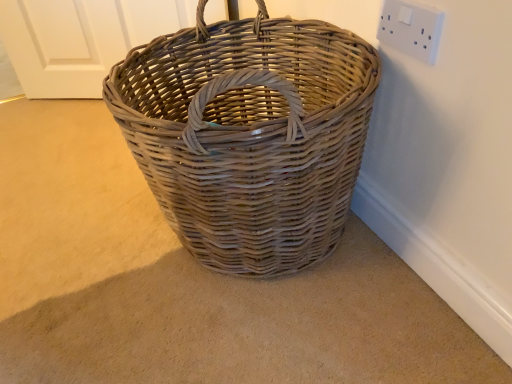
Question: Is white plastic socket at upper right not near natural wicker picnic basket at center?

Choices:
 (A) yes
 (B) no

Answer: (B)

Question: Can you confirm if white plastic socket at upper right is shorter than natural wicker picnic basket at center?

Choices:
 (A) no
 (B) yes

Answer: (B)

Question: Is the depth of white plastic socket at upper right greater than that of natural wicker picnic basket at center?

Choices:
 (A) yes
 (B) no

Answer: (A)

Question: Does white plastic socket at upper right touch natural wicker picnic basket at center?

Choices:
 (A) yes
 (B) no

Answer: (B)

Question: Is white plastic socket at upper right at the right side of natural wicker picnic basket at center?

Choices:
 (A) yes
 (B) no

Answer: (A)

Question: Is white plastic socket at upper right taller than natural wicker picnic basket at center?

Choices:
 (A) no
 (B) yes

Answer: (A)

Question: Could you tell me if natural wicker picnic basket at center is facing white plastic socket at upper right?

Choices:
 (A) yes
 (B) no

Answer: (B)

Question: Does natural wicker picnic basket at center come behind white plastic socket at upper right?

Choices:
 (A) no
 (B) yes

Answer: (A)

Question: From the image's perspective, is natural wicker picnic basket at center located above white plastic socket at upper right?

Choices:
 (A) no
 (B) yes

Answer: (A)

Question: Does natural wicker picnic basket at center have a smaller size compared to white plastic socket at upper right?

Choices:
 (A) no
 (B) yes

Answer: (A)

Question: Is natural wicker picnic basket at center surrounding white plastic socket at upper right?

Choices:
 (A) yes
 (B) no

Answer: (B)

Question: From a real-world perspective, is natural wicker picnic basket at center on white plastic socket at upper right?

Choices:
 (A) yes
 (B) no

Answer: (B)

Question: Does point (434, 13) appear closer or farther from the camera than point (202, 228)?

Choices:
 (A) closer
 (B) farther

Answer: (A)